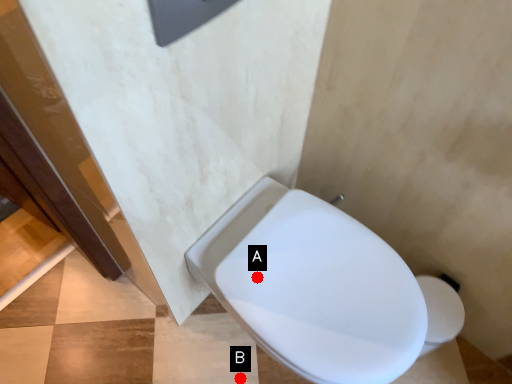
Question: Two points are circled on the image, labeled by A and B beside each circle. Which point is further to the camera?

Choices:
 (A) A is further
 (B) B is further

Answer: (B)